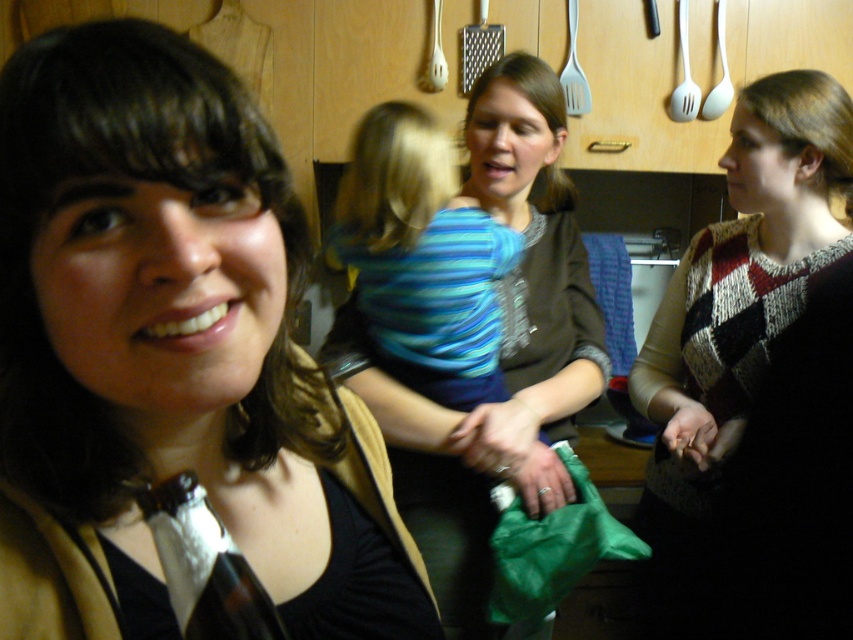
Question: Does matte brown sweater at center appear on the right side of knitted sweater at center?

Choices:
 (A) yes
 (B) no

Answer: (B)

Question: Which of these objects is positioned farthest from the knitted sweater at center?

Choices:
 (A) matte black jacket at left
 (B) matte brown sweater at center

Answer: (A)

Question: Which object appears closest to the camera in this image?

Choices:
 (A) matte brown sweater at center
 (B) knitted sweater at center
 (C) matte black jacket at left

Answer: (B)

Question: Is matte black jacket at left to the right of matte brown sweater at center from the viewer's perspective?

Choices:
 (A) yes
 (B) no

Answer: (B)

Question: Estimate the real-world distances between objects in this image. Which object is closer to the matte black jacket at left?

Choices:
 (A) knitted sweater at center
 (B) matte brown sweater at center

Answer: (A)

Question: Does matte black jacket at left have a greater width compared to knitted sweater at center?

Choices:
 (A) no
 (B) yes

Answer: (A)